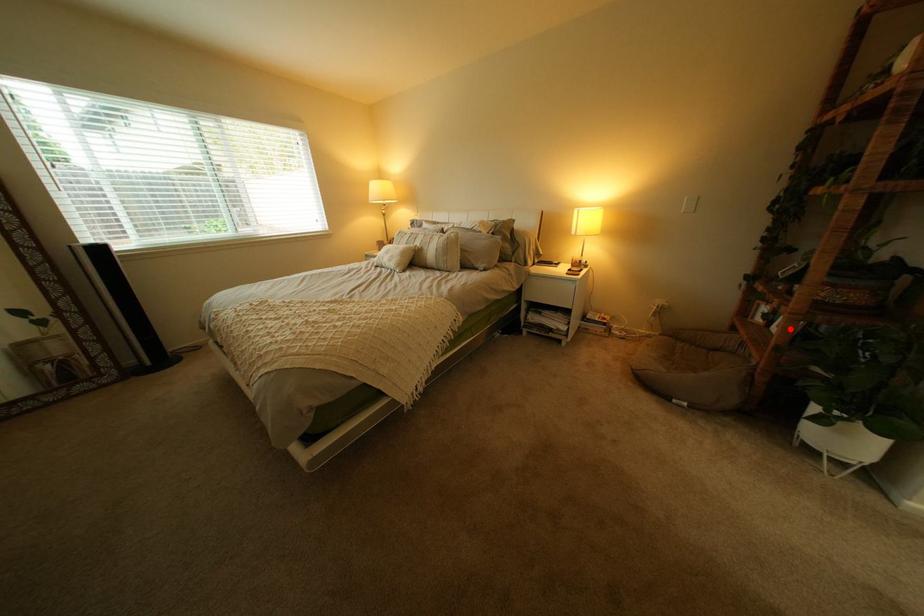
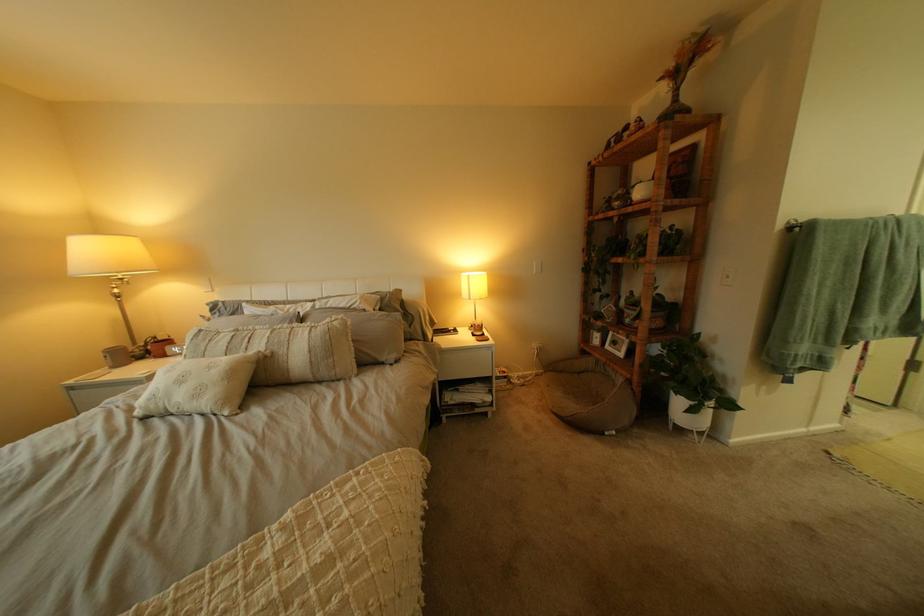
Question: I am providing you with two images of the same scene from different viewpoints. Given a red point in image1, look at the same physical point in image2. Is it:

Choices:
 (A) Closer to the viewpoint
 (B) Farther from the viewpoint

Answer: (A)